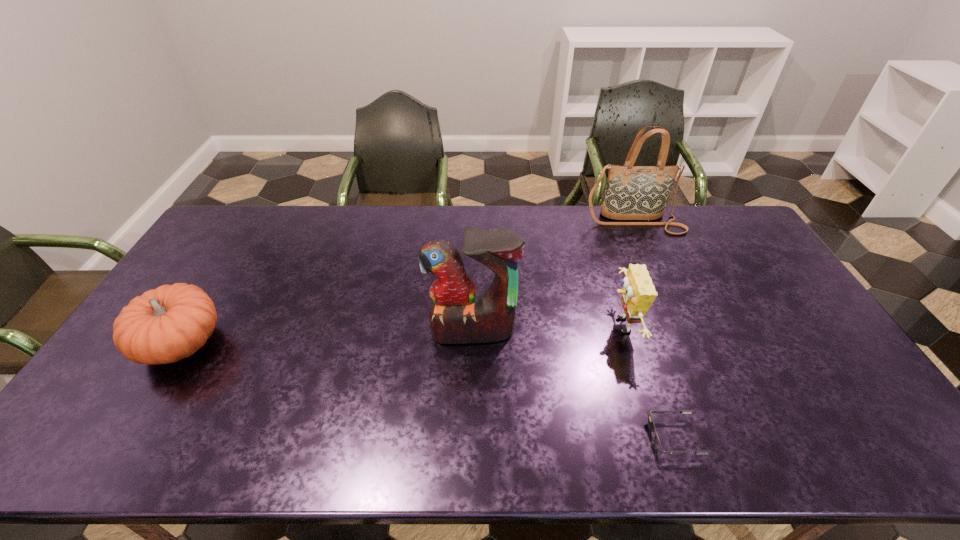
At what (x,y) coordinates should I click in order to perform the action: click on the farthest object. Please return your answer as a coordinate pair (x, y). The width and height of the screenshot is (960, 540). Looking at the image, I should click on (632, 192).

You are a GUI agent. You are given a task and a screenshot of the screen. Output one action in this format:
    pyautogui.click(x=<x>, y=<y>)
    Task: Click on the fourth object from right to left
    The height and width of the screenshot is (540, 960).
    Given the screenshot: What is the action you would take?
    pyautogui.click(x=458, y=316)

I want to click on the third shortest object, so click(638, 294).

Find the location of a particular element. Image resolution: width=960 pixels, height=540 pixels. pumpkin is located at coordinates (164, 325).

Identify the location of the leftmost object. (164, 325).

Image resolution: width=960 pixels, height=540 pixels. I want to click on the nearest object, so click(x=657, y=443).

Where is `the shortest object`? the shortest object is located at coordinates (657, 443).

Identify the location of vacant space located 0.330m on the front-facing side of the farthest object. (668, 301).

Find the location of a particular element. The height and width of the screenshot is (540, 960). vacant space located at the face of the second object from left to right is located at coordinates (470, 447).

Identify the location of free space located 0.260m on the face of the sponge. This screenshot has height=540, width=960. (518, 326).